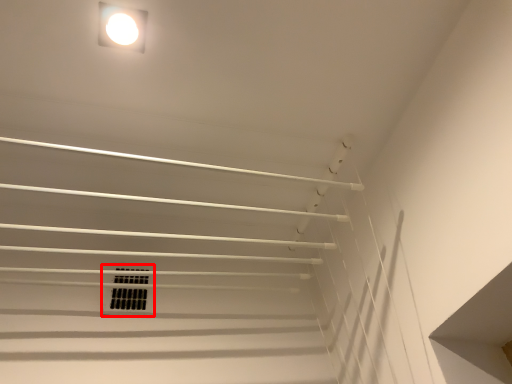
Question: From the image's perspective, considering the relative positions of window (annotated by the red box) and lamp in the image provided, where is window (annotated by the red box) located with respect to the staircase?

Choices:
 (A) above
 (B) below

Answer: (B)